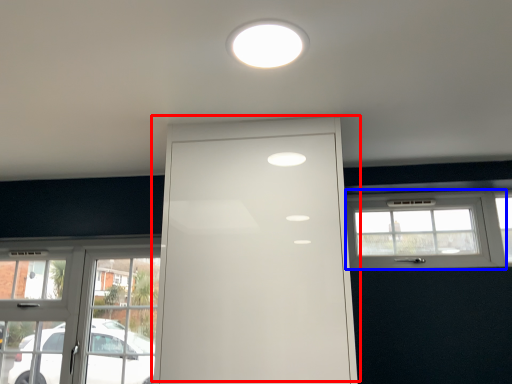
Question: Which of the following is the farthest to the observer, door (highlighted by a red box) or window (highlighted by a blue box)?

Choices:
 (A) door
 (B) window

Answer: (B)